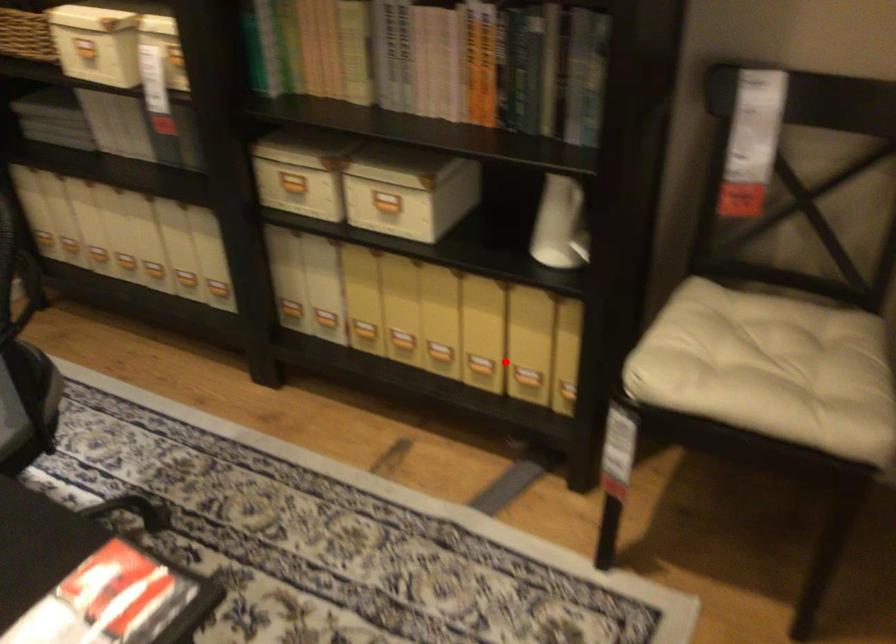
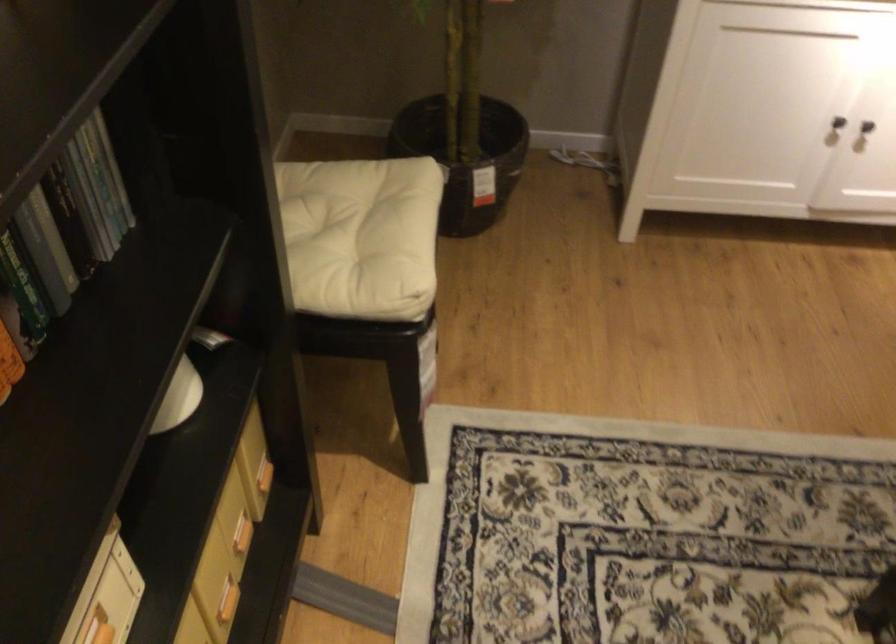
Question: I am providing you with two images of the same scene from different viewpoints. In image1, a red point is highlighted. Considering the same 3D point in image2, which of the following is correct?

Choices:
 (A) It is closer
 (B) It is farther

Answer: (A)